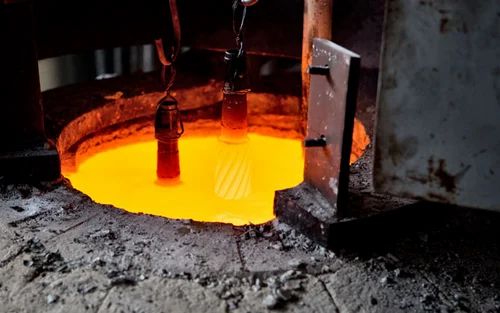
This screenshot has width=500, height=313. In order to click on wall in this screenshot , I will do `click(465, 138)`.